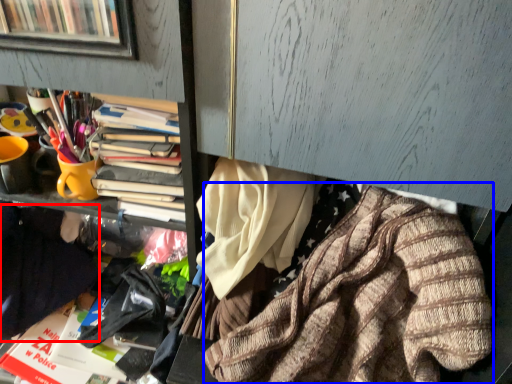
Question: Which object appears farthest to the camera in this image, clothing (highlighted by a red box) or clothing (highlighted by a blue box)?

Choices:
 (A) clothing
 (B) clothing

Answer: (A)